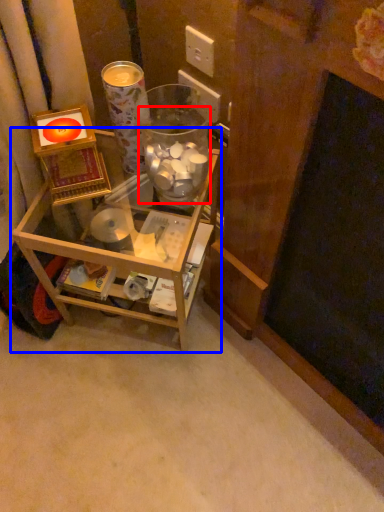
Question: Which point is further to the camera, glass jar (highlighted by a red box) or furniture (highlighted by a blue box)?

Choices:
 (A) glass jar
 (B) furniture

Answer: (B)